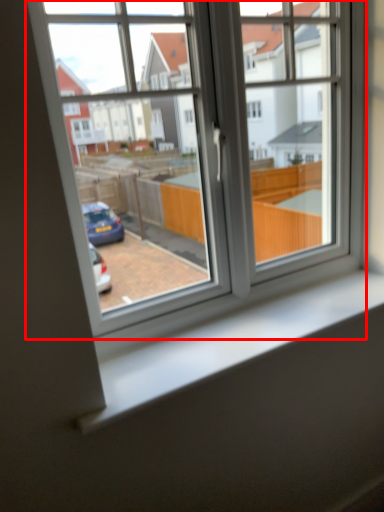
Question: From the image's perspective, what is the correct spatial relationship of window (annotated by the red box) in relation to window sill?

Choices:
 (A) above
 (B) below

Answer: (A)